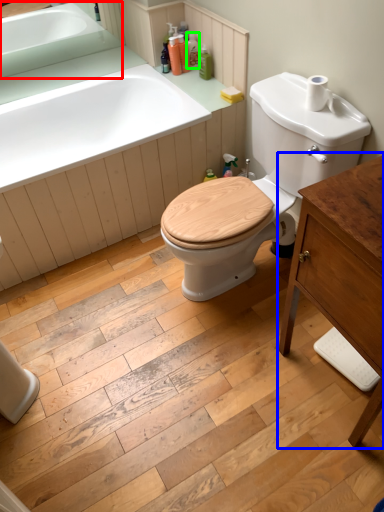
Question: Which object is positioned farthest from sink (highlighted by a red box)? Select from dresser (highlighted by a blue box) and toiletry (highlighted by a green box).

Choices:
 (A) dresser
 (B) toiletry

Answer: (A)